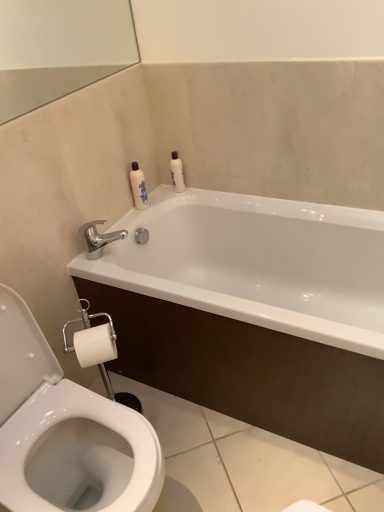
The width and height of the screenshot is (384, 512). What do you see at coordinates (98, 239) in the screenshot?
I see `polished metallic faucet at upper left` at bounding box center [98, 239].

Identify the location of white glossy bottle at upper right, placed as the second toiletry when sorted from left to right. (177, 172).

Which is more to the right, white glossy bottle at upper right, placed as the second toiletry when sorted from left to right, or white glossy bathtub at upper center?

From the viewer's perspective, white glossy bathtub at upper center appears more on the right side.

Which point is more forward, (177, 153) or (207, 308)?

The point (207, 308) is in front.

Is the depth of white glossy bottle at upper right, arranged as the first toiletry when viewed from the right, less than that of white glossy bathtub at upper center?

No, white glossy bottle at upper right, arranged as the first toiletry when viewed from the right, is further to the viewer.

Is white glossy bottle at upper right, placed as the second toiletry when sorted from left to right, aimed at white glossy bathtub at upper center?

No.

Does white glossy bathtub at upper center appear on the right side of polished metallic faucet at upper left?

Yes.

Considering the sizes of objects white glossy bathtub at upper center and polished metallic faucet at upper left in the image provided, who is shorter, white glossy bathtub at upper center or polished metallic faucet at upper left?

Standing shorter between the two is polished metallic faucet at upper left.

Would you say polished metallic faucet at upper left is part of white glossy bathtub at upper center's contents?

No, polished metallic faucet at upper left is located outside of white glossy bathtub at upper center.

Considering the relative sizes of white glossy bathtub at upper center and polished metallic faucet at upper left in the image provided, is white glossy bathtub at upper center smaller than polished metallic faucet at upper left?

No.

Between white glossy bathtub at upper center and white glossy bottle at upper center, the 2th toiletry in the right-to-left sequence, which one is positioned in front?

white glossy bathtub at upper center is closer to the camera.

From a real-world perspective, is white glossy bathtub at upper center below white glossy bottle at upper center, the 2th toiletry in the right-to-left sequence?

Yes, from a real-world perspective, white glossy bathtub at upper center is beneath white glossy bottle at upper center, the 2th toiletry in the right-to-left sequence.

Considering the sizes of objects white glossy bathtub at upper center and white glossy bottle at upper center, the 2th toiletry in the right-to-left sequence, in the image provided, who is thinner, white glossy bathtub at upper center or white glossy bottle at upper center, the 2th toiletry in the right-to-left sequence,?

white glossy bottle at upper center, the 2th toiletry in the right-to-left sequence, is thinner.

Is white glossy bathtub at upper center to the right of white glossy bottle at upper center, the 1th toiletry positioned from the left, from the viewer's perspective?

Indeed, white glossy bathtub at upper center is positioned on the right side of white glossy bottle at upper center, the 1th toiletry positioned from the left.

From the image's perspective, which is below, white glossy bottle at upper center, the 1th toiletry positioned from the left, or polished metallic faucet at upper left?

polished metallic faucet at upper left, from the image's perspective.

Is white glossy bottle at upper center, the 2th toiletry in the right-to-left sequence, turned away from polished metallic faucet at upper left?

white glossy bottle at upper center, the 2th toiletry in the right-to-left sequence, does not have its back to polished metallic faucet at upper left.

Is white glossy bottle at upper center, the 2th toiletry in the right-to-left sequence, behind polished metallic faucet at upper left?

That is True.

Considering the points (137, 164) and (91, 245), which point is in front, point (137, 164) or point (91, 245)?

The point (91, 245) is in front.

Is polished metallic faucet at upper left wider or thinner than white glossy bathtub at upper center?

Clearly, polished metallic faucet at upper left has less width compared to white glossy bathtub at upper center.

Considering the positions of objects polished metallic faucet at upper left and white glossy bathtub at upper center in the image provided, who is more to the left, polished metallic faucet at upper left or white glossy bathtub at upper center?

polished metallic faucet at upper left.

From a real-world perspective, is polished metallic faucet at upper left located beneath white glossy bathtub at upper center?

No.

Considering the relative sizes of white glossy bottle at upper right, arranged as the first toiletry when viewed from the right, and white glossy bottle at upper center, the 1th toiletry positioned from the left, in the image provided, is white glossy bottle at upper right, arranged as the first toiletry when viewed from the right, wider than white glossy bottle at upper center, the 1th toiletry positioned from the left,?

No, white glossy bottle at upper right, arranged as the first toiletry when viewed from the right, is not wider than white glossy bottle at upper center, the 1th toiletry positioned from the left.

Find the location of a particular element. The image size is (384, 512). toiletry above the white glossy bottle at upper center, the 2th toiletry in the right-to-left sequence (from the image's perspective) is located at coordinates (177, 172).

Would you consider white glossy bottle at upper right, placed as the second toiletry when sorted from left to right, to be distant from white glossy bottle at upper center, the 2th toiletry in the right-to-left sequence?

white glossy bottle at upper right, placed as the second toiletry when sorted from left to right, is near white glossy bottle at upper center, the 2th toiletry in the right-to-left sequence, not far away.

Based on their positions, is white glossy bottle at upper right, arranged as the first toiletry when viewed from the right, located to the left or right of white glossy bottle at upper center, the 1th toiletry positioned from the left?

From the image, it's evident that white glossy bottle at upper right, arranged as the first toiletry when viewed from the right, is to the right of white glossy bottle at upper center, the 1th toiletry positioned from the left.

Is white glossy bathtub at upper center not close to white glossy bottle at upper right, placed as the second toiletry when sorted from left to right?

That's not correct — white glossy bathtub at upper center is a little close to white glossy bottle at upper right, placed as the second toiletry when sorted from left to right.

From the image's perspective, relative to white glossy bottle at upper right, arranged as the first toiletry when viewed from the right, is white glossy bathtub at upper center above or below?

Based on their image positions, white glossy bathtub at upper center is located beneath white glossy bottle at upper right, arranged as the first toiletry when viewed from the right.

From a real-world perspective, relative to white glossy bottle at upper right, arranged as the first toiletry when viewed from the right, is white glossy bathtub at upper center vertically above or below?

In terms of real-world spatial position, white glossy bathtub at upper center is below white glossy bottle at upper right, arranged as the first toiletry when viewed from the right.

Is white glossy bathtub at upper center smaller than white glossy bottle at upper right, arranged as the first toiletry when viewed from the right?

Actually, white glossy bathtub at upper center might be larger than white glossy bottle at upper right, arranged as the first toiletry when viewed from the right.

At what (x,y) coordinates should I click in order to perform the action: click on bathtub on the right of white glossy bottle at upper right, placed as the second toiletry when sorted from left to right. Please return your answer as a coordinate pair (x, y). The image size is (384, 512). Looking at the image, I should click on (254, 313).

Image resolution: width=384 pixels, height=512 pixels. I want to click on bathtub below the polished metallic faucet at upper left (from a real-world perspective), so click(254, 313).

From the image, which object appears to be farther from white glossy bathtub at upper center, polished metallic faucet at upper left or white glossy bottle at upper right, placed as the second toiletry when sorted from left to right?

The object further to white glossy bathtub at upper center is white glossy bottle at upper right, placed as the second toiletry when sorted from left to right.

From the image, which object appears to be farther from white glossy bottle at upper right, placed as the second toiletry when sorted from left to right, white glossy bathtub at upper center or polished metallic faucet at upper left?

white glossy bathtub at upper center is further to white glossy bottle at upper right, placed as the second toiletry when sorted from left to right.

Based on their spatial positions, is white glossy bathtub at upper center or white glossy bottle at upper center, the 1th toiletry positioned from the left, further from white glossy bottle at upper right, placed as the second toiletry when sorted from left to right?

white glossy bathtub at upper center is further to white glossy bottle at upper right, placed as the second toiletry when sorted from left to right.

Based on the photo, based on their spatial positions, is polished metallic faucet at upper left or white glossy bathtub at upper center further from white glossy bottle at upper center, the 2th toiletry in the right-to-left sequence?

The object further to white glossy bottle at upper center, the 2th toiletry in the right-to-left sequence, is white glossy bathtub at upper center.

In the scene shown: Which object lies nearer to the anchor point white glossy bottle at upper right, placed as the second toiletry when sorted from left to right, polished metallic faucet at upper left or white glossy bathtub at upper center?

polished metallic faucet at upper left.

Looking at the image, which one is located closer to polished metallic faucet at upper left, white glossy bottle at upper center, the 1th toiletry positioned from the left, or white glossy bottle at upper right, placed as the second toiletry when sorted from left to right?

white glossy bottle at upper center, the 1th toiletry positioned from the left.

Which object lies further to the anchor point polished metallic faucet at upper left, white glossy bathtub at upper center or white glossy bottle at upper right, arranged as the first toiletry when viewed from the right?

The object further to polished metallic faucet at upper left is white glossy bathtub at upper center.

From the image, which object appears to be farther from white glossy bottle at upper right, arranged as the first toiletry when viewed from the right, white glossy bottle at upper center, the 2th toiletry in the right-to-left sequence, or white glossy bathtub at upper center?

white glossy bathtub at upper center lies further to white glossy bottle at upper right, arranged as the first toiletry when viewed from the right, than the other object.

Find the location of a particular element. tap positioned between white glossy bathtub at upper center and white glossy bottle at upper right, placed as the second toiletry when sorted from left to right, from near to far is located at coordinates pyautogui.click(x=98, y=239).

In order to click on toiletry between white glossy bathtub at upper center and white glossy bottle at upper right, arranged as the first toiletry when viewed from the right, from front to back in this screenshot , I will do `click(138, 187)`.

This screenshot has height=512, width=384. I want to click on tap between white glossy bathtub at upper center and white glossy bottle at upper center, the 2th toiletry in the right-to-left sequence, along the z-axis, so click(98, 239).

Where is `toiletry located between polished metallic faucet at upper left and white glossy bottle at upper right, arranged as the first toiletry when viewed from the right, in the depth direction`? This screenshot has height=512, width=384. toiletry located between polished metallic faucet at upper left and white glossy bottle at upper right, arranged as the first toiletry when viewed from the right, in the depth direction is located at coordinates (138, 187).